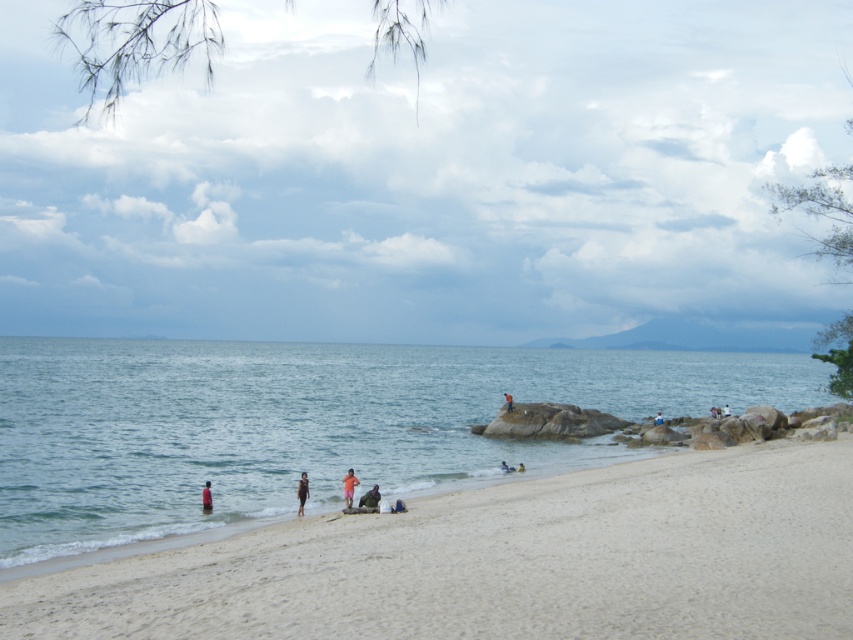
Who is lower down, pink fabric at center or smooth yellow swimmer at center?

smooth yellow swimmer at center is lower down.

Is pink fabric at center to the right of smooth yellow swimmer at center from the viewer's perspective?

No, pink fabric at center is not to the right of smooth yellow swimmer at center.

Which is in front, point (343, 483) or point (519, 465)?

Positioned in front is point (343, 483).

I want to click on pink fabric at center, so click(347, 486).

Does dark brown fabric bag at center have a lesser width compared to light brown wooden stick at center?

Yes, dark brown fabric bag at center is thinner than light brown wooden stick at center.

Is point (376, 493) closer to camera compared to point (718, 412)?

That is True.

This screenshot has width=853, height=640. Describe the element at coordinates (369, 497) in the screenshot. I see `dark brown fabric bag at center` at that location.

Locate an element on the screen. Image resolution: width=853 pixels, height=640 pixels. dark brown fabric bag at center is located at coordinates (369, 497).

Between light brown wooden stick at center and smooth skin person at lower center, which one has less height?

smooth skin person at lower center is shorter.

Find the location of a particular element. Image resolution: width=853 pixels, height=640 pixels. light brown wooden stick at center is located at coordinates (715, 412).